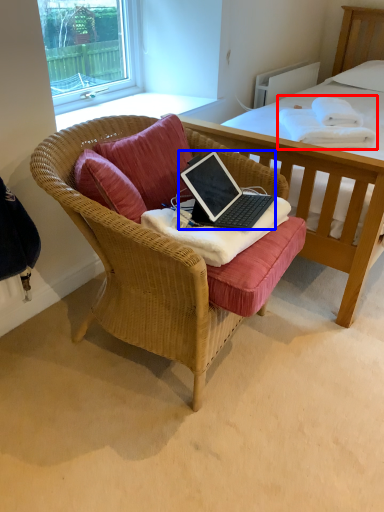
Question: Which point is closer to the camera, blanket (highlighted by a red box) or laptop (highlighted by a blue box)?

Choices:
 (A) blanket
 (B) laptop

Answer: (B)